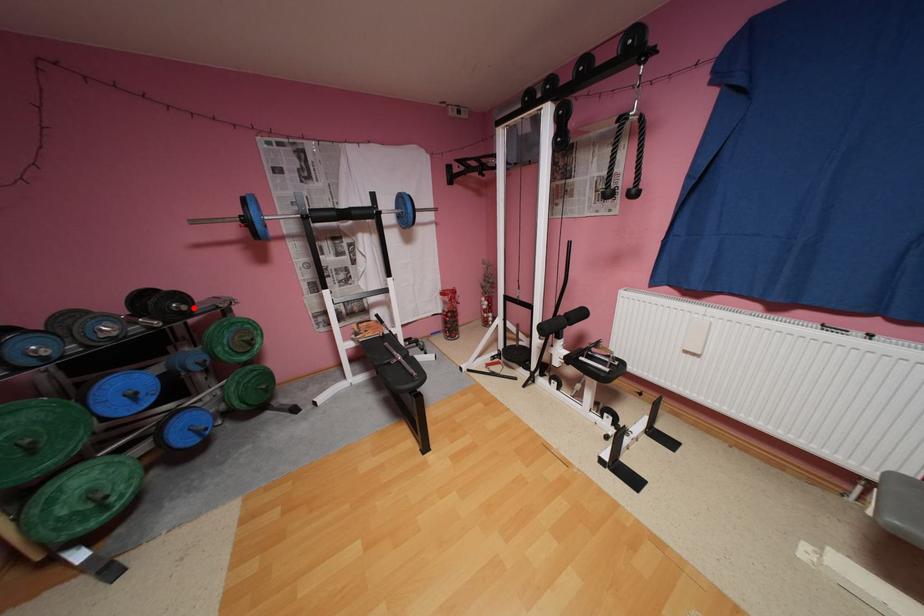
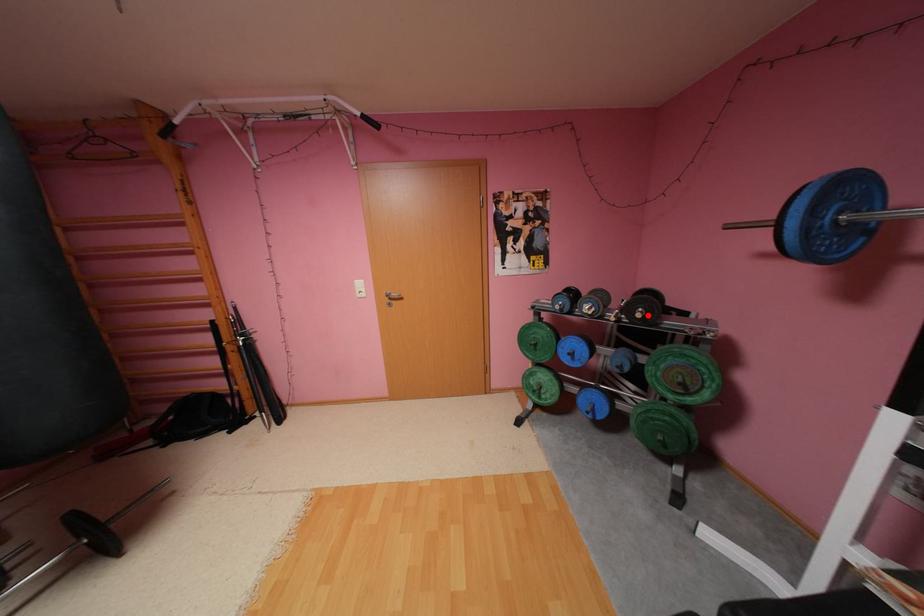
In the scene shown: I am providing you with two images of the same scene from different viewpoints. A red point is marked on the first image and another point is marked on the second image. Is the red point in image1 aligned with the point shown in image2?

Yes